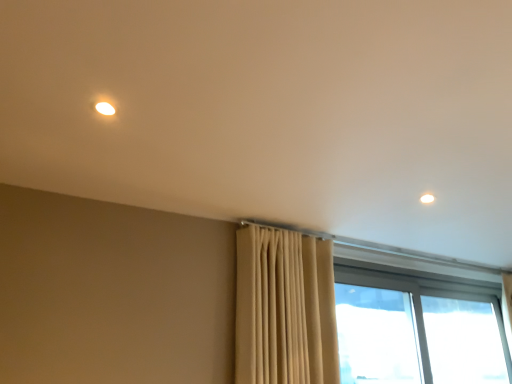
Question: Should I look upward or downward to see transparent glass window at lower right, marked as the first window in a left-to-right arrangement?

Choices:
 (A) down
 (B) up

Answer: (A)

Question: Considering the relative sizes of transparent glass window at right, the first window when ordered from right to left, and transparent glass window at lower right, which is counted as the second window, starting from the right, in the image provided, is transparent glass window at right, the first window when ordered from right to left, thinner than transparent glass window at lower right, which is counted as the second window, starting from the right,?

Choices:
 (A) yes
 (B) no

Answer: (B)

Question: Considering the relative sizes of transparent glass window at right, the 2th window when ordered from left to right, and transparent glass window at lower right, which is counted as the second window, starting from the right, in the image provided, is transparent glass window at right, the 2th window when ordered from left to right, shorter than transparent glass window at lower right, which is counted as the second window, starting from the right,?

Choices:
 (A) no
 (B) yes

Answer: (A)

Question: Is transparent glass window at right, the 2th window when ordered from left to right, surrounding transparent glass window at lower right, marked as the first window in a left-to-right arrangement?

Choices:
 (A) yes
 (B) no

Answer: (B)

Question: Is the position of transparent glass window at right, the first window when ordered from right to left, more distant than that of transparent glass window at lower right, which is counted as the second window, starting from the right?

Choices:
 (A) yes
 (B) no

Answer: (A)

Question: Is transparent glass window at right, the 2th window when ordered from left to right, to the left of transparent glass window at lower right, marked as the first window in a left-to-right arrangement, from the viewer's perspective?

Choices:
 (A) no
 (B) yes

Answer: (A)

Question: Is transparent glass window at right, the first window when ordered from right to left, facing towards transparent glass window at lower right, marked as the first window in a left-to-right arrangement?

Choices:
 (A) no
 (B) yes

Answer: (B)

Question: From the image's perspective, would you say transparent glass window at right, the first window when ordered from right to left, is shown under beige fabric curtain at center?

Choices:
 (A) yes
 (B) no

Answer: (A)

Question: Is the surface of transparent glass window at right, the first window when ordered from right to left, in direct contact with beige fabric curtain at center?

Choices:
 (A) no
 (B) yes

Answer: (A)

Question: Is beige fabric curtain at center surrounded by transparent glass window at right, the first window when ordered from right to left?

Choices:
 (A) no
 (B) yes

Answer: (A)

Question: From a real-world perspective, is transparent glass window at right, the 2th window when ordered from left to right, under beige fabric curtain at center?

Choices:
 (A) no
 (B) yes

Answer: (B)

Question: Considering the relative sizes of transparent glass window at right, the first window when ordered from right to left, and beige fabric curtain at center in the image provided, is transparent glass window at right, the first window when ordered from right to left, taller than beige fabric curtain at center?

Choices:
 (A) no
 (B) yes

Answer: (A)

Question: Is transparent glass window at right, the first window when ordered from right to left, positioned in front of beige fabric curtain at center?

Choices:
 (A) no
 (B) yes

Answer: (A)

Question: Is beige fabric curtain at center at the right side of transparent glass window at lower right, marked as the first window in a left-to-right arrangement?

Choices:
 (A) no
 (B) yes

Answer: (A)